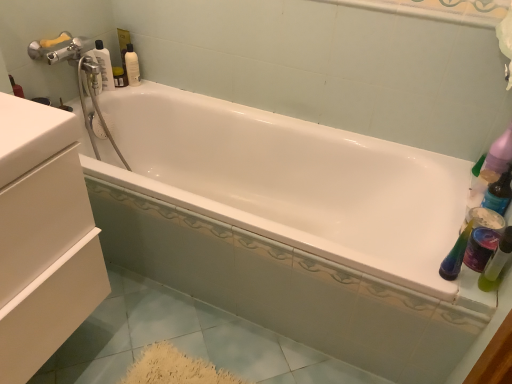
You are a GUI agent. You are given a task and a screenshot of the screen. Output one action in this format:
    pyautogui.click(x=<x>, y=<y>)
    Task: Click on the vacant space to the right of transparent plastic bottle at upper left
    Image resolution: width=512 pixels, height=384 pixels.
    Given the screenshot: What is the action you would take?
    pyautogui.click(x=140, y=87)